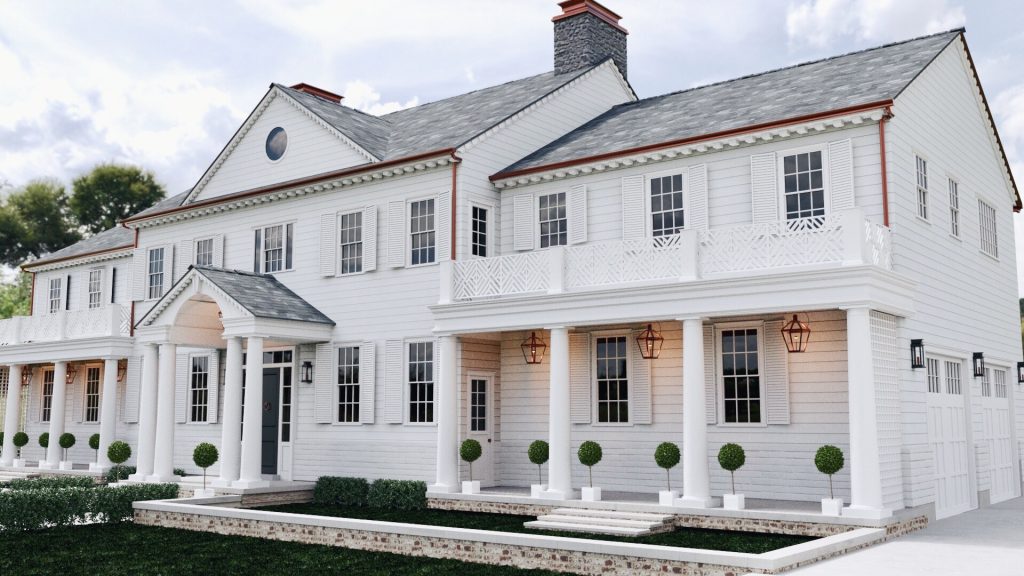
Identify the location of circular window. This screenshot has height=576, width=1024. (271, 143).